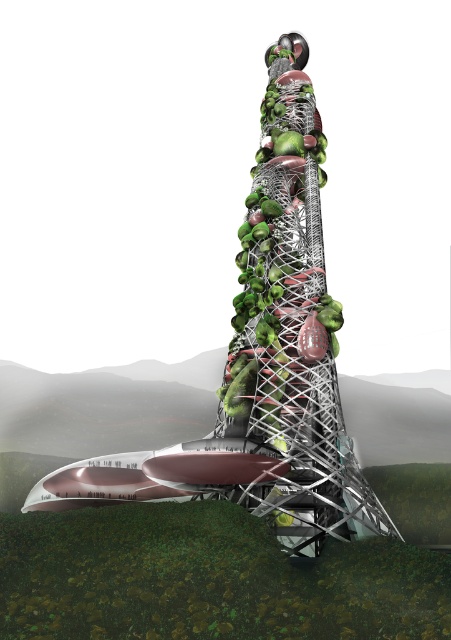
Is brushed metal boat at center taller than metallic greenery at center?

Correct, brushed metal boat at center is much taller as metallic greenery at center.

The height and width of the screenshot is (640, 451). Describe the element at coordinates (263, 362) in the screenshot. I see `brushed metal boat at center` at that location.

At what (x,y) coordinates should I click in order to perform the action: click on brushed metal boat at center. Please return your answer as a coordinate pair (x, y). This screenshot has height=640, width=451. Looking at the image, I should click on (263, 362).